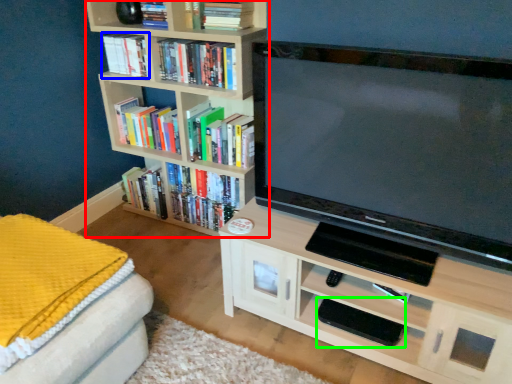
Question: Which object is the farthest from bookcase (highlighted by a red box)? Choose among these: book (highlighted by a blue box) or pad (highlighted by a green box).

Choices:
 (A) book
 (B) pad

Answer: (B)